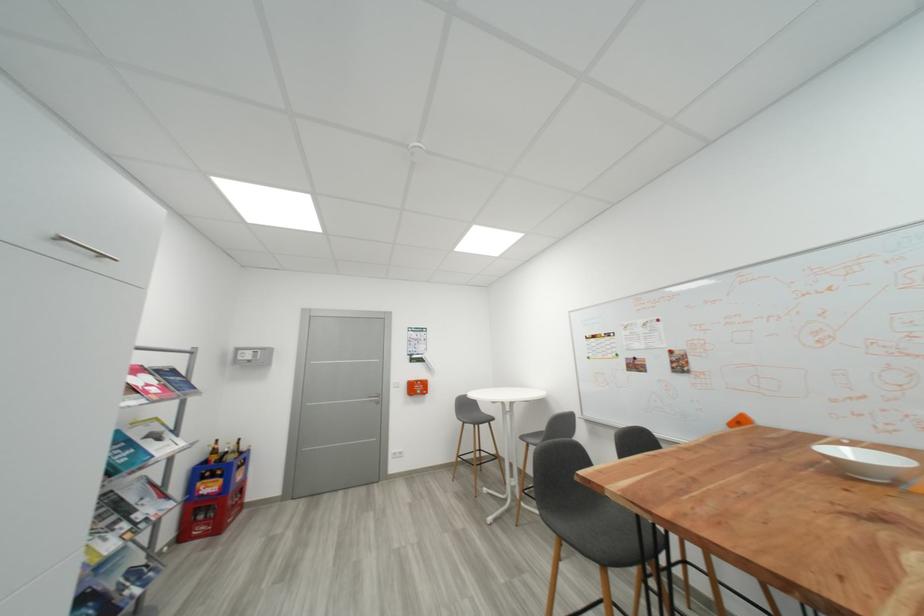
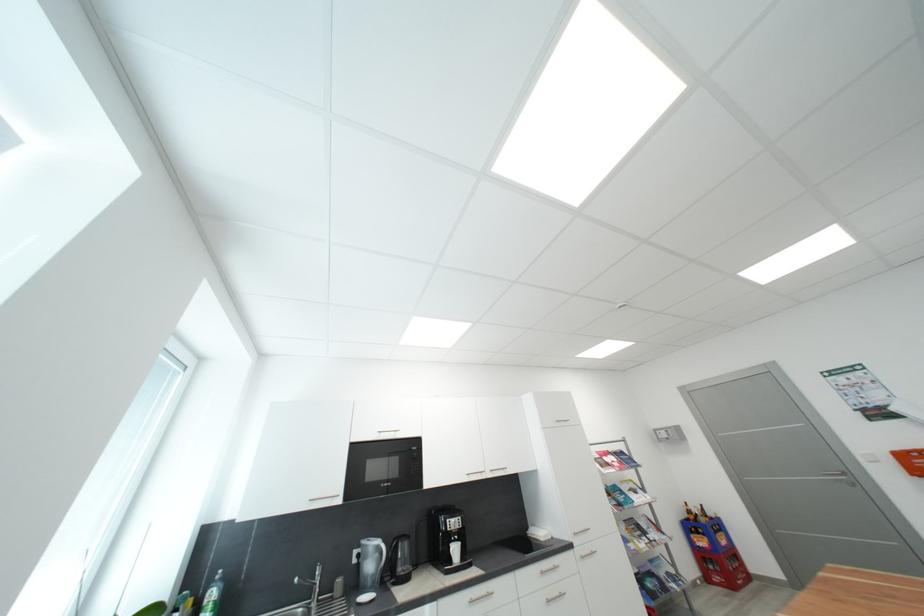
Locate, in the second image, the point that corresponds to the point at 237,459 in the first image.

(710, 522)